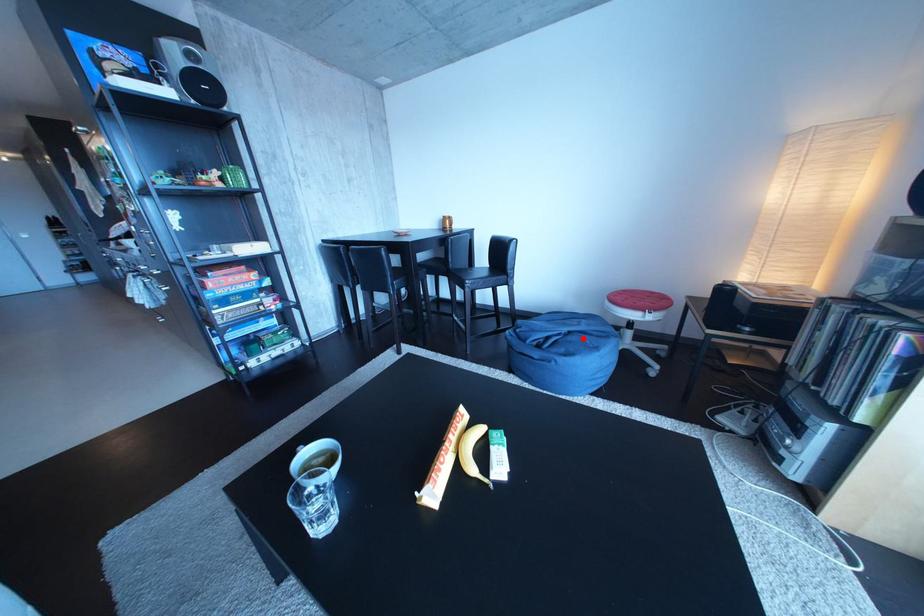
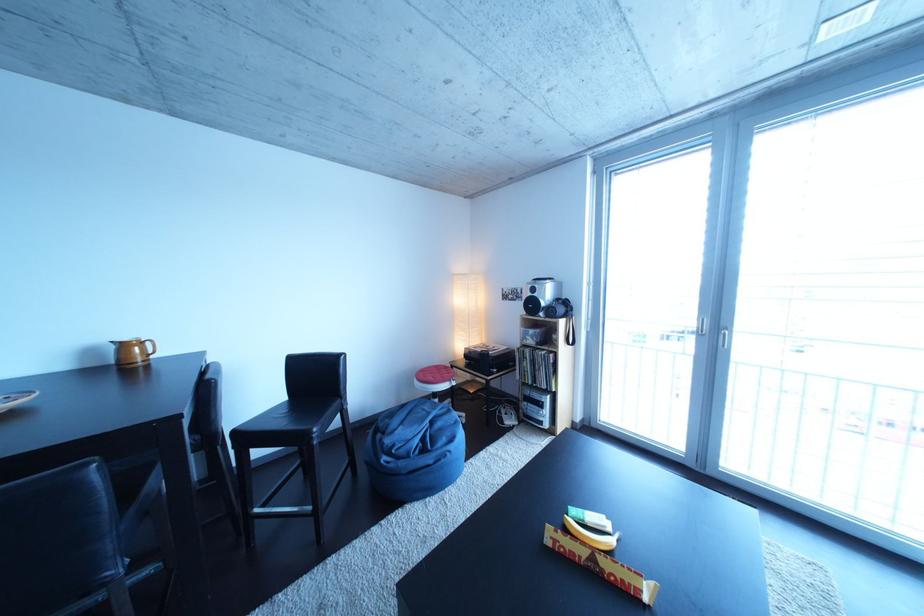
Question: A red point is marked in image1. In image2, is the corresponding 3D point closer to the camera or farther? Reply with the corresponding letter.

Choices:
 (A) The corresponding 3D point is closer.
 (B) The corresponding 3D point is farther.

Answer: (A)